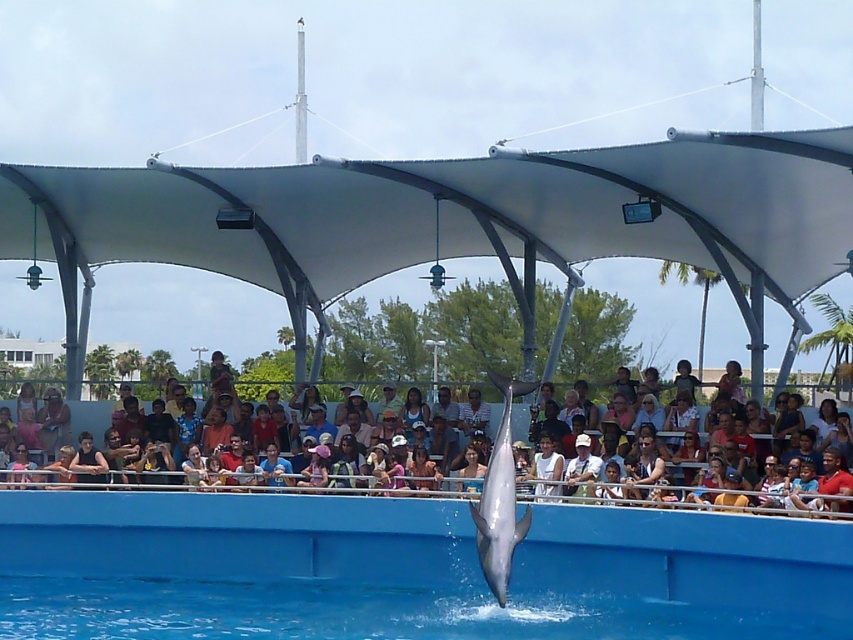
Question: Does multicolored fabric crowd at center come behind white cap at center?

Choices:
 (A) yes
 (B) no

Answer: (B)

Question: Among these objects, which one is farthest from the camera?

Choices:
 (A) white cap at center
 (B) multicolored fabric crowd at center
 (C) white smooth dolphin at center

Answer: (A)

Question: Can you confirm if multicolored fabric crowd at center is positioned to the right of white smooth dolphin at center?

Choices:
 (A) yes
 (B) no

Answer: (B)

Question: Does blue smooth water at center have a smaller size compared to multicolored fabric crowd at center?

Choices:
 (A) yes
 (B) no

Answer: (A)

Question: Which object appears farthest from the camera in this image?

Choices:
 (A) white smooth dolphin at center
 (B) blue smooth water at center

Answer: (A)

Question: Which of these objects is positioned closest to the white smooth dolphin at center?

Choices:
 (A) multicolored fabric crowd at center
 (B) blue smooth water at center
 (C) white cap at center

Answer: (A)